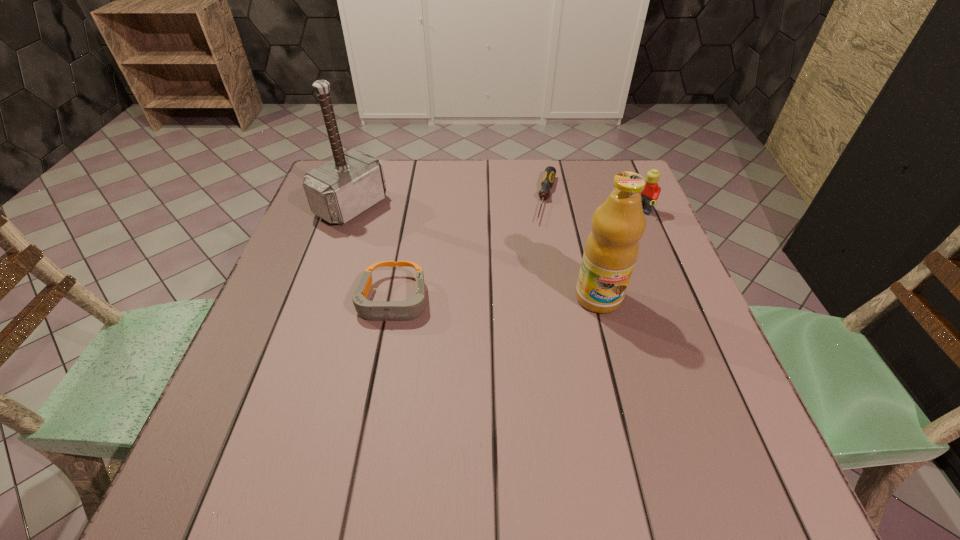
The height and width of the screenshot is (540, 960). I want to click on object positioned at the left edge, so tap(341, 189).

Locate an element on the screen. The image size is (960, 540). olive oil situated at the right edge is located at coordinates (611, 250).

Where is `Lego located in the right edge section of the desktop`? Lego located in the right edge section of the desktop is located at coordinates (651, 192).

Identify the location of object situated at the far left corner. Image resolution: width=960 pixels, height=540 pixels. (341, 189).

The width and height of the screenshot is (960, 540). Find the location of `object situated at the far right corner`. object situated at the far right corner is located at coordinates (651, 192).

Identify the location of vacant space at the far edge of the desktop. (402, 181).

Identify the location of vacant space at the near edge of the desktop. The height and width of the screenshot is (540, 960). (578, 392).

I want to click on free location at the left edge of the desktop, so click(x=296, y=261).

This screenshot has height=540, width=960. In the image, there is a desktop. Identify the location of vacant space at the right edge. [694, 314].

You are a GUI agent. You are given a task and a screenshot of the screen. Output one action in this format:
    pyautogui.click(x=<x>, y=<y>)
    Task: Click on the free space at the far right corner of the desktop
    This screenshot has height=540, width=960.
    Given the screenshot: What is the action you would take?
    pyautogui.click(x=608, y=161)